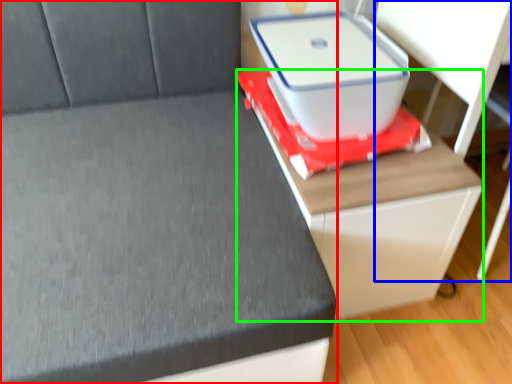
Question: Which object is positioned farthest from furniture (highlighted by a red box)? Select from computer desk (highlighted by a blue box) and table (highlighted by a green box).

Choices:
 (A) computer desk
 (B) table

Answer: (A)